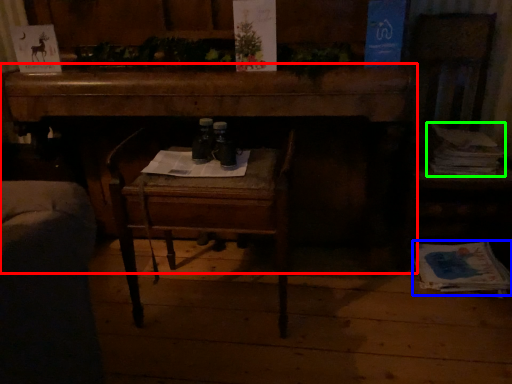
Question: Which object is positioned farthest from desk (highlighted by a red box)? Select from magazine (highlighted by a blue box) and magazine (highlighted by a green box).

Choices:
 (A) magazine
 (B) magazine

Answer: (A)